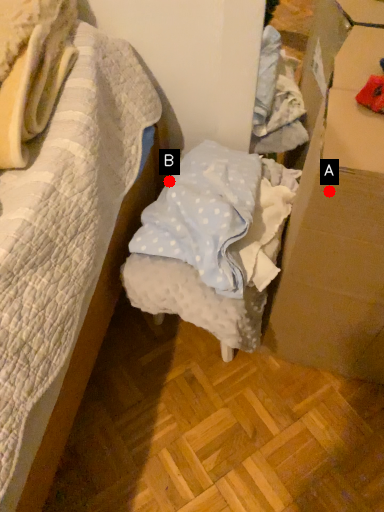
Question: Two points are circled on the image, labeled by A and B beside each circle. Which point appears farthest from the camera in this image?

Choices:
 (A) A is further
 (B) B is further

Answer: (B)